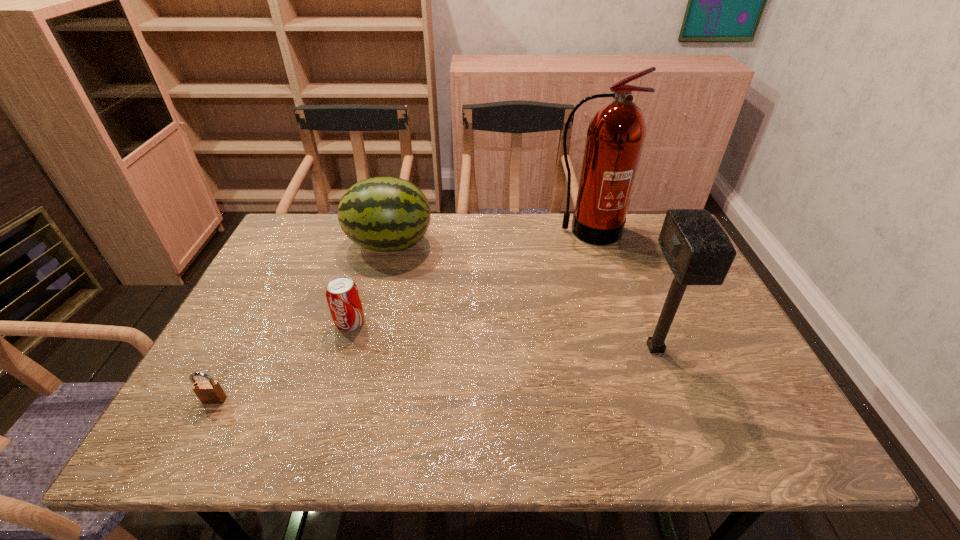
Locate which object is the second closest to the watermelon. Please provide its 2D coordinates. Your answer should be formatted as a tuple, i.e. [(x, y)], where the tuple contains the x and y coordinates of a point satisfying the conditions above.

[(616, 134)]

At what (x,y) coordinates should I click in order to perform the action: click on free space that satisfies the following two spatial constraints: 1. on the front-facing side of the tallest object; 2. at the stem end of the third shortest object. Please return your answer as a coordinate pair (x, y). This screenshot has height=540, width=960. Looking at the image, I should click on (590, 244).

Find the location of a particular element. free location that satisfies the following two spatial constraints: 1. on the front-facing side of the mallet; 2. on the left side of the fire extinguisher is located at coordinates (623, 348).

You are a GUI agent. You are given a task and a screenshot of the screen. Output one action in this format:
    pyautogui.click(x=<x>, y=<y>)
    Task: Click on the free space that satisfies the following two spatial constraints: 1. on the front-facing side of the fire extinguisher; 2. on the left side of the mallet
    
    Given the screenshot: What is the action you would take?
    pyautogui.click(x=623, y=348)

Find the location of a particular element. vacant space that satisfies the following two spatial constraints: 1. at the stem end of the watermelon; 2. on the left side of the mallet is located at coordinates (363, 348).